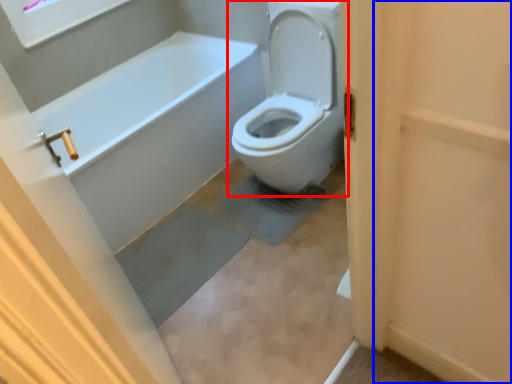
Question: Which of the following is the farthest to the observer, toilet (highlighted by a red box) or screen door (highlighted by a blue box)?

Choices:
 (A) toilet
 (B) screen door

Answer: (A)